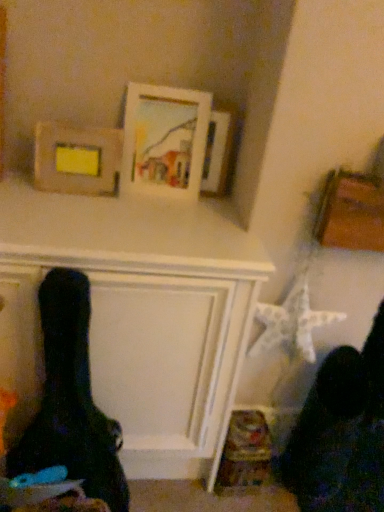
You are a GUI agent. You are given a task and a screenshot of the screen. Output one action in this format:
    pyautogui.click(x=<x>, y=<y>)
    Task: Click on the wooden frame at upper left, which appears as the 1th picture frame when viewed from the left
    The image size is (384, 512).
    Given the screenshot: What is the action you would take?
    pyautogui.click(x=77, y=158)

Is white matte picture frame at upper center, positioned as the 2th picture frame in left-to-right order, inside or outside of wooden frame at upper left, which appears as the 3th picture frame when viewed from the right?

The correct answer is: outside.

From the image's perspective, starting from the wooden frame at upper left, which appears as the 3th picture frame when viewed from the right, which picture frame is the 2nd one above? Please provide its 2D coordinates.

[(164, 140)]

Considering the sizes of objects white matte picture frame at upper center, which is the second picture frame in right-to-left order, and wooden frame at upper left, which appears as the 1th picture frame when viewed from the left, in the image provided, who is taller, white matte picture frame at upper center, which is the second picture frame in right-to-left order, or wooden frame at upper left, which appears as the 1th picture frame when viewed from the left,?

With more height is white matte picture frame at upper center, which is the second picture frame in right-to-left order.

Is white matte picture frame at upper center, which is the second picture frame in right-to-left order, bigger or smaller than wooden frame at upper left, which appears as the 3th picture frame when viewed from the right?

white matte picture frame at upper center, which is the second picture frame in right-to-left order, is bigger than wooden frame at upper left, which appears as the 3th picture frame when viewed from the right.

From a real-world perspective, is wooden picture frame at upper center, which ranks as the 1th picture frame in right-to-left order, physically below white matte picture frame at upper center, which is the second picture frame in right-to-left order?

Yes, from a real-world perspective, wooden picture frame at upper center, which ranks as the 1th picture frame in right-to-left order, is beneath white matte picture frame at upper center, which is the second picture frame in right-to-left order.

Is wooden picture frame at upper center, the 3th picture frame in the left-to-right sequence, turned away from white matte picture frame at upper center, positioned as the 2th picture frame in left-to-right order?

That's not correct — wooden picture frame at upper center, the 3th picture frame in the left-to-right sequence, is not looking away from white matte picture frame at upper center, positioned as the 2th picture frame in left-to-right order.

Consider the image. Between wooden picture frame at upper center, which ranks as the 1th picture frame in right-to-left order, and white matte picture frame at upper center, which is the second picture frame in right-to-left order, which one is positioned in front?

white matte picture frame at upper center, which is the second picture frame in right-to-left order.

From the image's perspective, is wooden picture frame at upper center, which ranks as the 1th picture frame in right-to-left order, above or below white matte picture frame at upper center, positioned as the 2th picture frame in left-to-right order?

From the image's perspective, wooden picture frame at upper center, which ranks as the 1th picture frame in right-to-left order, appears below white matte picture frame at upper center, positioned as the 2th picture frame in left-to-right order.

Is white matte picture frame at upper center, which is the second picture frame in right-to-left order, positioned with its back to wooden picture frame at upper center, which ranks as the 1th picture frame in right-to-left order?

No, white matte picture frame at upper center, which is the second picture frame in right-to-left order, is not facing away from wooden picture frame at upper center, which ranks as the 1th picture frame in right-to-left order.

From the image's perspective, is white matte picture frame at upper center, which is the second picture frame in right-to-left order, positioned above or below wooden picture frame at upper center, the 3th picture frame in the left-to-right sequence?

Clearly, from the image's perspective, white matte picture frame at upper center, which is the second picture frame in right-to-left order, is above wooden picture frame at upper center, the 3th picture frame in the left-to-right sequence.

Considering the relative sizes of white matte picture frame at upper center, which is the second picture frame in right-to-left order, and wooden picture frame at upper center, the 3th picture frame in the left-to-right sequence, in the image provided, is white matte picture frame at upper center, which is the second picture frame in right-to-left order, smaller than wooden picture frame at upper center, the 3th picture frame in the left-to-right sequence,?

No.

Are white matte picture frame at upper center, positioned as the 2th picture frame in left-to-right order, and wooden picture frame at upper center, which ranks as the 1th picture frame in right-to-left order, far apart?

No.

Based on the photo, from a real-world perspective, which is physically below, wooden frame at upper left, which appears as the 3th picture frame when viewed from the right, or white matte picture frame at upper center, which is the second picture frame in right-to-left order?

wooden frame at upper left, which appears as the 3th picture frame when viewed from the right, from a real-world perspective.

Could you tell me if wooden frame at upper left, which appears as the 3th picture frame when viewed from the right, is facing white matte picture frame at upper center, which is the second picture frame in right-to-left order?

No, wooden frame at upper left, which appears as the 3th picture frame when viewed from the right, does not turn towards white matte picture frame at upper center, which is the second picture frame in right-to-left order.

Do you think wooden frame at upper left, which appears as the 3th picture frame when viewed from the right, is within white matte picture frame at upper center, positioned as the 2th picture frame in left-to-right order, or outside of it?

wooden frame at upper left, which appears as the 3th picture frame when viewed from the right, is outside white matte picture frame at upper center, positioned as the 2th picture frame in left-to-right order.

Looking at their sizes, would you say wooden frame at upper left, which appears as the 1th picture frame when viewed from the left, is wider or thinner than white matte picture frame at upper center, positioned as the 2th picture frame in left-to-right order?

Clearly, wooden frame at upper left, which appears as the 1th picture frame when viewed from the left, has less width compared to white matte picture frame at upper center, positioned as the 2th picture frame in left-to-right order.

From a real-world perspective, between wooden frame at upper left, which appears as the 3th picture frame when viewed from the right, and wooden picture frame at upper center, the 3th picture frame in the left-to-right sequence, who is vertically lower?

wooden frame at upper left, which appears as the 3th picture frame when viewed from the right, is physically lower.

Is wooden frame at upper left, which appears as the 1th picture frame when viewed from the left, in front of or behind wooden picture frame at upper center, which ranks as the 1th picture frame in right-to-left order, in the image?

Visually, wooden frame at upper left, which appears as the 1th picture frame when viewed from the left, is located in front of wooden picture frame at upper center, which ranks as the 1th picture frame in right-to-left order.

The height and width of the screenshot is (512, 384). What are the coordinates of `the 1st picture frame positioned above the wooden frame at upper left, which appears as the 1th picture frame when viewed from the left (from a real-world perspective)` in the screenshot? It's located at (217, 153).

Consider the image. Are wooden picture frame at upper center, the 3th picture frame in the left-to-right sequence, and wooden frame at upper left, which appears as the 1th picture frame when viewed from the left, far apart?

They are positioned close to each other.

Can you tell me how much wooden picture frame at upper center, which ranks as the 1th picture frame in right-to-left order, and wooden frame at upper left, which appears as the 3th picture frame when viewed from the right, differ in facing direction?

13.4 degrees.

Is wooden picture frame at upper center, which ranks as the 1th picture frame in right-to-left order, in front of or behind wooden frame at upper left, which appears as the 1th picture frame when viewed from the left, in the image?

Clearly, wooden picture frame at upper center, which ranks as the 1th picture frame in right-to-left order, is behind wooden frame at upper left, which appears as the 1th picture frame when viewed from the left.

From a real-world perspective, which object rests below the other?

wooden frame at upper left, which appears as the 1th picture frame when viewed from the left, from a real-world perspective.

Identify the location of the 2nd picture frame below when counting from the white matte picture frame at upper center, positioned as the 2th picture frame in left-to-right order (from the image's perspective). (77, 158).

The image size is (384, 512). In order to click on picture frame that is the 1st one when counting forward from the wooden picture frame at upper center, the 3th picture frame in the left-to-right sequence in this screenshot , I will do (164, 140).

Estimate the real-world distances between objects in this image. Which object is closer to wooden frame at upper left, which appears as the 1th picture frame when viewed from the left, white matte picture frame at upper center, positioned as the 2th picture frame in left-to-right order, or wooden picture frame at upper center, which ranks as the 1th picture frame in right-to-left order?

white matte picture frame at upper center, positioned as the 2th picture frame in left-to-right order, is positioned closer to the anchor wooden frame at upper left, which appears as the 1th picture frame when viewed from the left.

Looking at the image, which one is located closer to wooden frame at upper left, which appears as the 3th picture frame when viewed from the right, wooden picture frame at upper center, which ranks as the 1th picture frame in right-to-left order, or white matte picture frame at upper center, which is the second picture frame in right-to-left order?

white matte picture frame at upper center, which is the second picture frame in right-to-left order, is closer to wooden frame at upper left, which appears as the 3th picture frame when viewed from the right.

From the image, which object appears to be nearer to white matte picture frame at upper center, which is the second picture frame in right-to-left order, wooden frame at upper left, which appears as the 1th picture frame when viewed from the left, or wooden picture frame at upper center, the 3th picture frame in the left-to-right sequence?

wooden picture frame at upper center, the 3th picture frame in the left-to-right sequence, is closer to white matte picture frame at upper center, which is the second picture frame in right-to-left order.

From the picture: From the image, which object appears to be nearer to wooden picture frame at upper center, which ranks as the 1th picture frame in right-to-left order, white matte picture frame at upper center, positioned as the 2th picture frame in left-to-right order, or wooden frame at upper left, which appears as the 3th picture frame when viewed from the right?

white matte picture frame at upper center, positioned as the 2th picture frame in left-to-right order, is closer to wooden picture frame at upper center, which ranks as the 1th picture frame in right-to-left order.

Estimate the real-world distances between objects in this image. Which object is further from white matte picture frame at upper center, which is the second picture frame in right-to-left order, wooden picture frame at upper center, the 3th picture frame in the left-to-right sequence, or wooden frame at upper left, which appears as the 1th picture frame when viewed from the left?

wooden frame at upper left, which appears as the 1th picture frame when viewed from the left, is further to white matte picture frame at upper center, which is the second picture frame in right-to-left order.

When comparing their distances from wooden picture frame at upper center, the 3th picture frame in the left-to-right sequence, does wooden frame at upper left, which appears as the 1th picture frame when viewed from the left, or white matte picture frame at upper center, which is the second picture frame in right-to-left order, seem further?

Among the two, wooden frame at upper left, which appears as the 1th picture frame when viewed from the left, is located further to wooden picture frame at upper center, the 3th picture frame in the left-to-right sequence.

Identify the location of picture frame between wooden frame at upper left, which appears as the 3th picture frame when viewed from the right, and wooden picture frame at upper center, which ranks as the 1th picture frame in right-to-left order, from left to right. (164, 140).